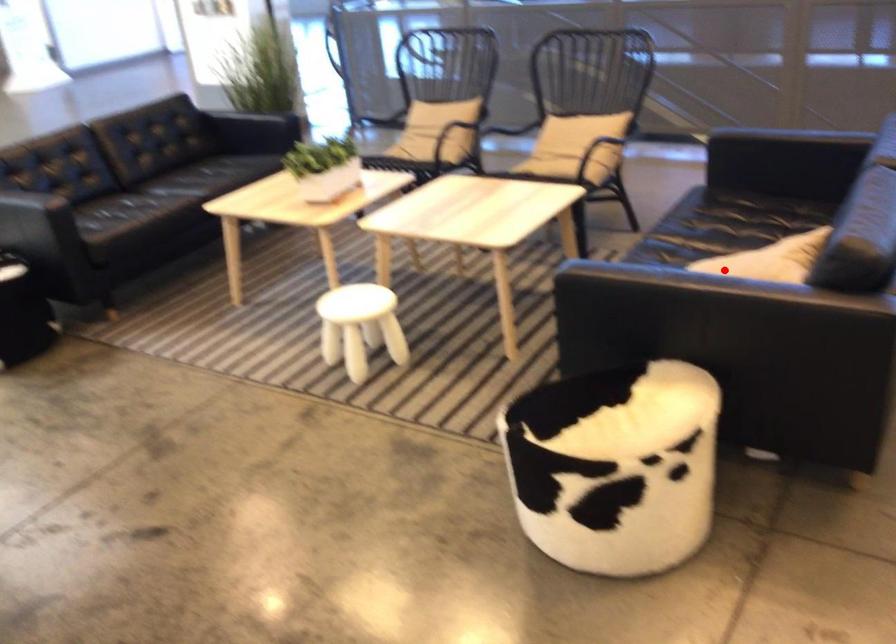
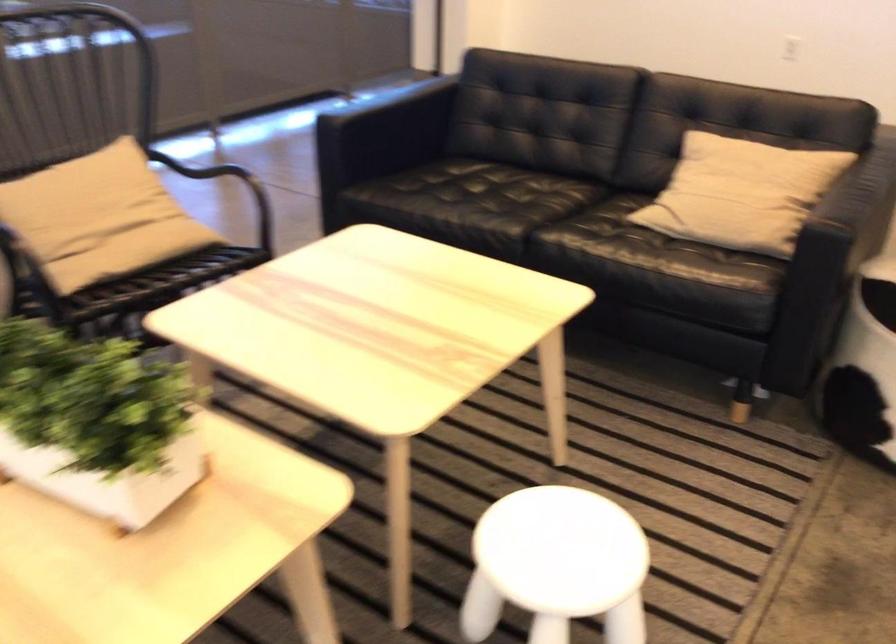
Where in the second image is the point corresponding to the highlighted location from the first image?

(741, 193)